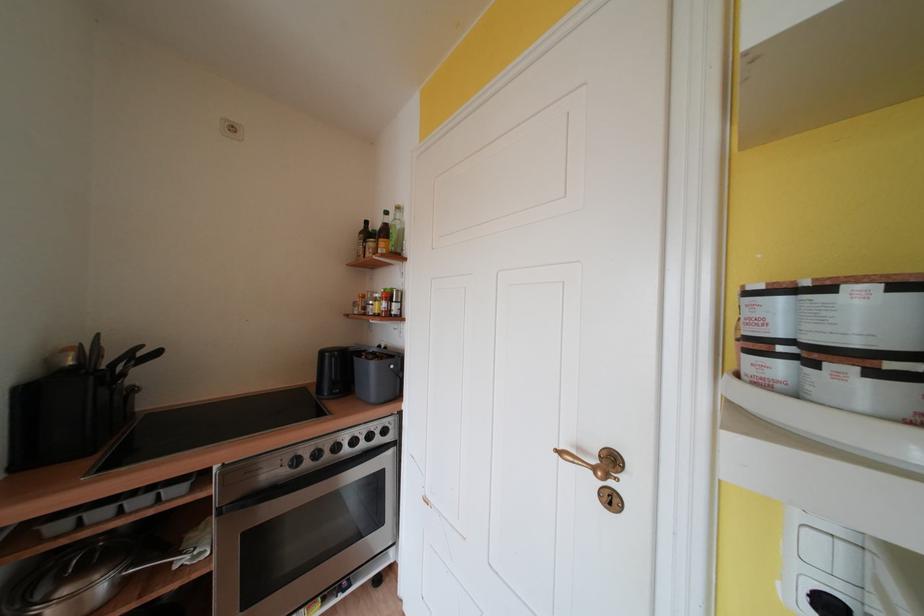
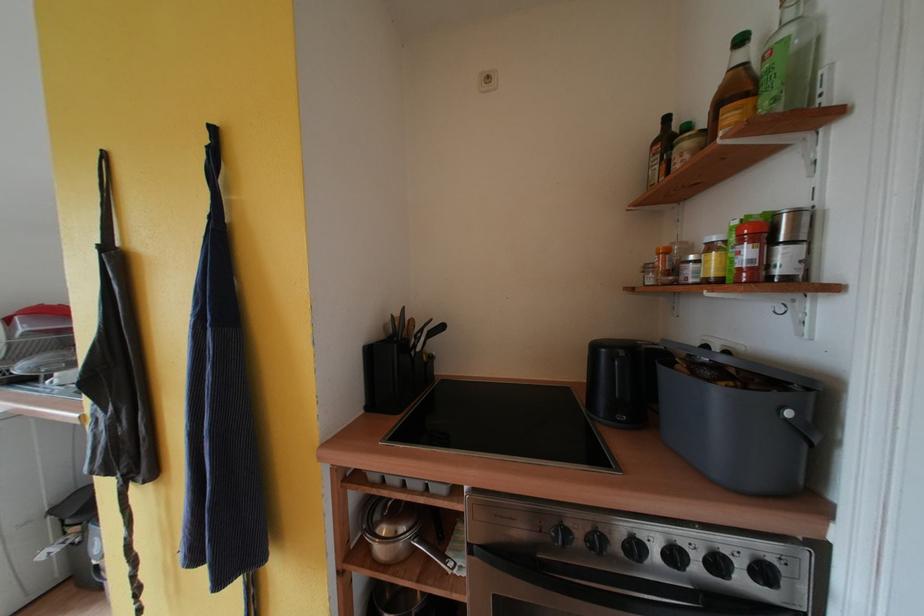
Question: The images are taken continuously from a first-person perspective. In which direction is your viewpoint rotating?

Choices:
 (A) Left
 (B) Right
 (C) Up
 (D) Down

Answer: (A)